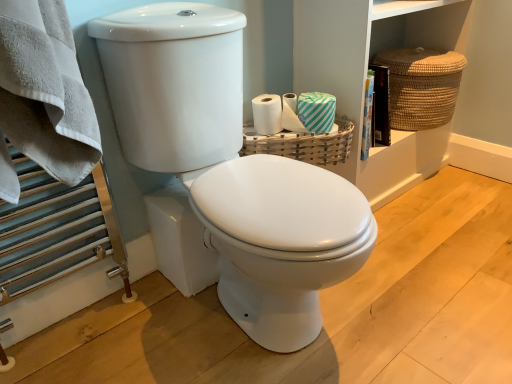
Question: Does braided straw basket at upper right, the 2th basket viewed from the front, have a greater width compared to brown woven basket at upper right?

Choices:
 (A) no
 (B) yes

Answer: (B)

Question: Does braided straw basket at upper right, placed as the first basket when sorted from back to front, have a lesser width compared to brown woven basket at upper right?

Choices:
 (A) no
 (B) yes

Answer: (A)

Question: Is braided straw basket at upper right, which is the 1th basket from top to bottom, at the left side of brown woven basket at upper right?

Choices:
 (A) yes
 (B) no

Answer: (B)

Question: Does braided straw basket at upper right, arranged as the second basket when ordered from the bottom, lie in front of brown woven basket at upper right?

Choices:
 (A) no
 (B) yes

Answer: (A)

Question: Is braided straw basket at upper right, which is the second basket from left to right, aimed at brown woven basket at upper right?

Choices:
 (A) no
 (B) yes

Answer: (B)

Question: From a real-world perspective, is braided straw basket at upper right, placed as the first basket when sorted from back to front, physically above brown woven basket at upper right?

Choices:
 (A) yes
 (B) no

Answer: (A)

Question: Does braided straw basket at upper right, the 2th basket viewed from the front, have a lesser height compared to white glossy toilet at center, which is the first toilet from back to front?

Choices:
 (A) no
 (B) yes

Answer: (B)

Question: Are braided straw basket at upper right, placed as the first basket when sorted from back to front, and white glossy toilet at center, marked as the second toilet in a front-to-back arrangement, far apart?

Choices:
 (A) yes
 (B) no

Answer: (B)

Question: Does braided straw basket at upper right, the 2th basket viewed from the front, have a greater width compared to white glossy toilet at center, which is the first toilet from back to front?

Choices:
 (A) no
 (B) yes

Answer: (B)

Question: From the image's perspective, is braided straw basket at upper right, the 2th basket viewed from the front, located above white glossy toilet at center, marked as the second toilet in a front-to-back arrangement?

Choices:
 (A) no
 (B) yes

Answer: (B)

Question: From a real-world perspective, is braided straw basket at upper right, which is the 1th basket from top to bottom, beneath white glossy toilet at center, which is the first toilet from back to front?

Choices:
 (A) yes
 (B) no

Answer: (B)

Question: Would you say white glossy toilet at center, marked as the second toilet in a front-to-back arrangement, is part of braided straw basket at upper right, which is the 1th basket from top to bottom,'s contents?

Choices:
 (A) no
 (B) yes

Answer: (A)

Question: Is woven wood basket at upper right, marked as the 1th basket in a bottom-to-top arrangement, positioned before braided straw basket at upper right, placed as the first basket when sorted from back to front?

Choices:
 (A) yes
 (B) no

Answer: (A)